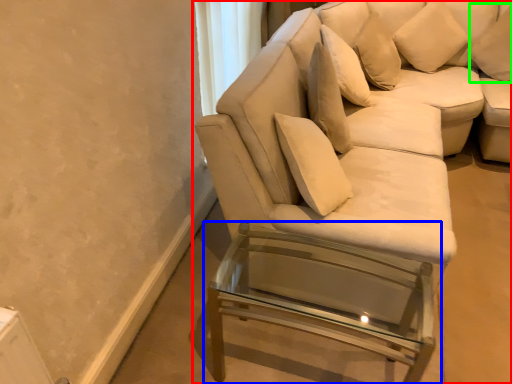
Question: Considering the real-world distances, which object is farthest from studio couch (highlighted by a red box)? table (highlighted by a blue box) or pillow (highlighted by a green box)?

Choices:
 (A) table
 (B) pillow

Answer: (B)